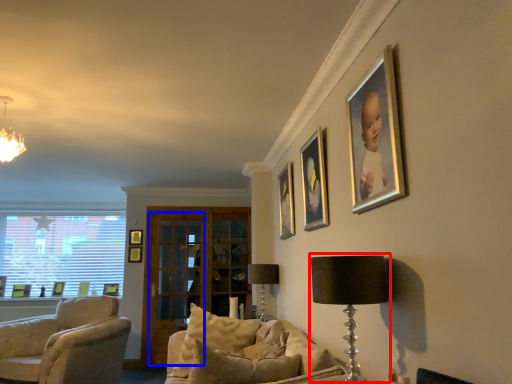
Question: Which object appears closest to the camera in this image, table lamp (highlighted by a red box) or glass door (highlighted by a blue box)?

Choices:
 (A) table lamp
 (B) glass door

Answer: (A)